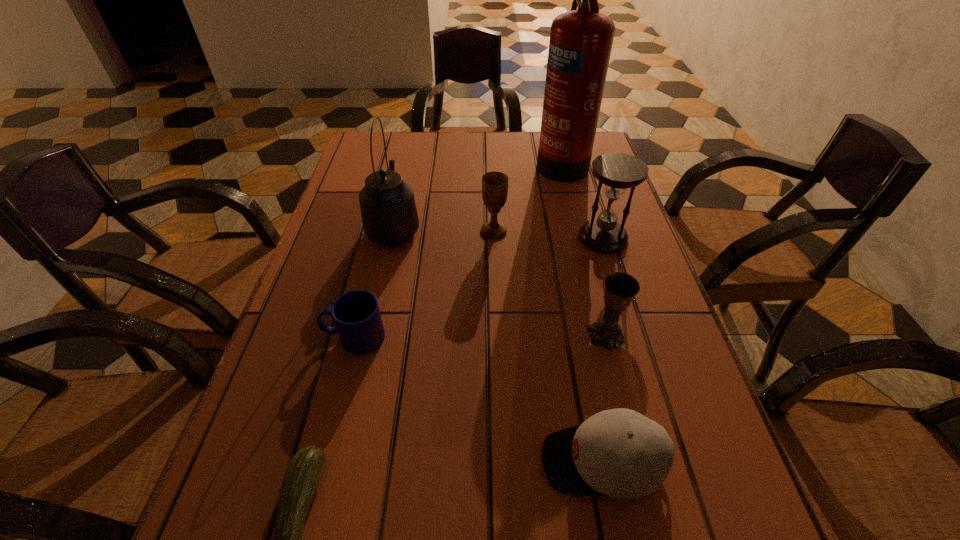
In the image, there is a desktop. Identify the location of vacant space at the left edge. (372, 241).

The height and width of the screenshot is (540, 960). I want to click on free space at the right edge, so click(x=695, y=429).

Where is `vacant region at the far left corner`? The width and height of the screenshot is (960, 540). vacant region at the far left corner is located at coordinates (373, 140).

Locate an element on the screen. The image size is (960, 540). free area in between the sixth shortest object and the mug is located at coordinates (479, 287).

Locate an element on the screen. Image resolution: width=960 pixels, height=540 pixels. free space between the baseball cap and the right chalice is located at coordinates [604, 398].

I want to click on vacant region between the mug and the fifth object from right to left, so pos(424,284).

Where is `vacant area that lies between the baseball cap and the mug`? This screenshot has height=540, width=960. vacant area that lies between the baseball cap and the mug is located at coordinates (478, 399).

Identify the location of free space that is in between the farthest object and the nearer chalice. This screenshot has width=960, height=540. (584, 248).

In order to click on empty space between the hourglass and the mug in this screenshot , I will do `click(479, 287)`.

Identify the location of empty space that is in between the right chalice and the hourglass. The image size is (960, 540). (604, 286).